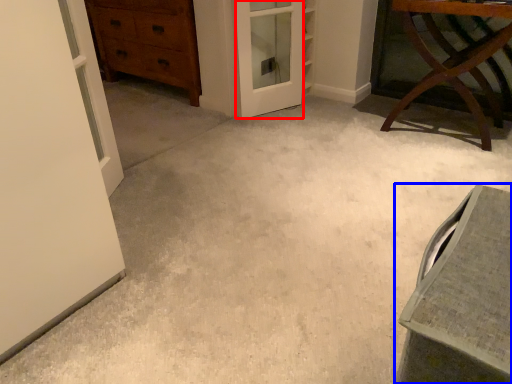
Question: Which point is closer to the camera, screen door (highlighted by a red box) or vanity (highlighted by a blue box)?

Choices:
 (A) screen door
 (B) vanity

Answer: (B)